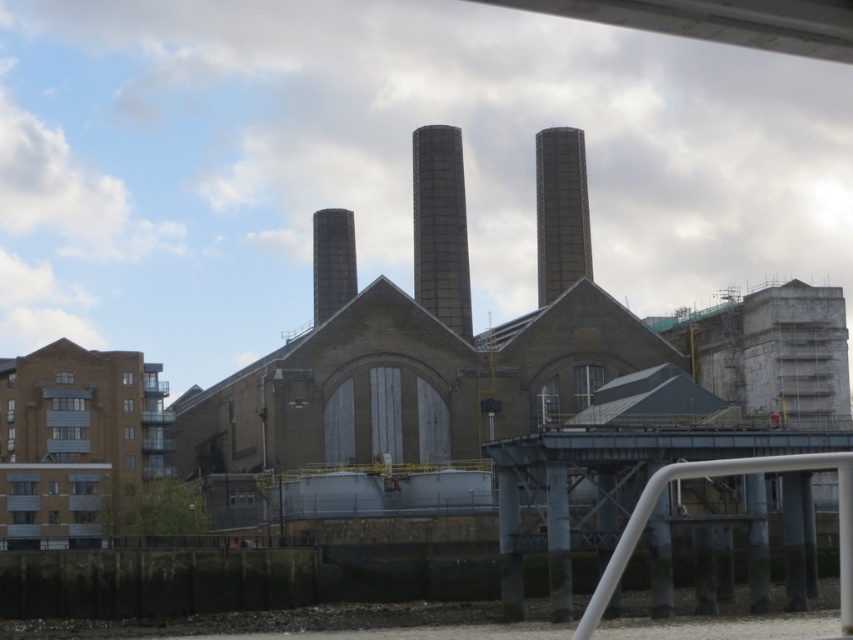
Question: Based on their relative distances, which object is farther from the dark gray textured chimney at center?

Choices:
 (A) smooth gray chimney at center
 (B) dark gray concrete chimney at center
 (C) white metallic rail at lower right

Answer: (C)

Question: Estimate the real-world distances between objects in this image. Which object is farther from the dark gray concrete chimney at center?

Choices:
 (A) white metallic rail at lower right
 (B) dark gray textured chimney at center
 (C) smooth gray chimney at center

Answer: (A)

Question: Can you confirm if dark gray concrete chimney at center is positioned above dark gray textured chimney at center?

Choices:
 (A) no
 (B) yes

Answer: (B)

Question: Is white metallic rail at lower right to the right of smooth gray chimney at center from the viewer's perspective?

Choices:
 (A) yes
 (B) no

Answer: (A)

Question: Estimate the real-world distances between objects in this image. Which object is closer to the white metallic rail at lower right?

Choices:
 (A) smooth gray chimney at center
 (B) dark gray concrete chimney at center

Answer: (B)

Question: Where is dark gray concrete chimney at center located in relation to dark gray textured chimney at center in the image?

Choices:
 (A) left
 (B) right

Answer: (A)